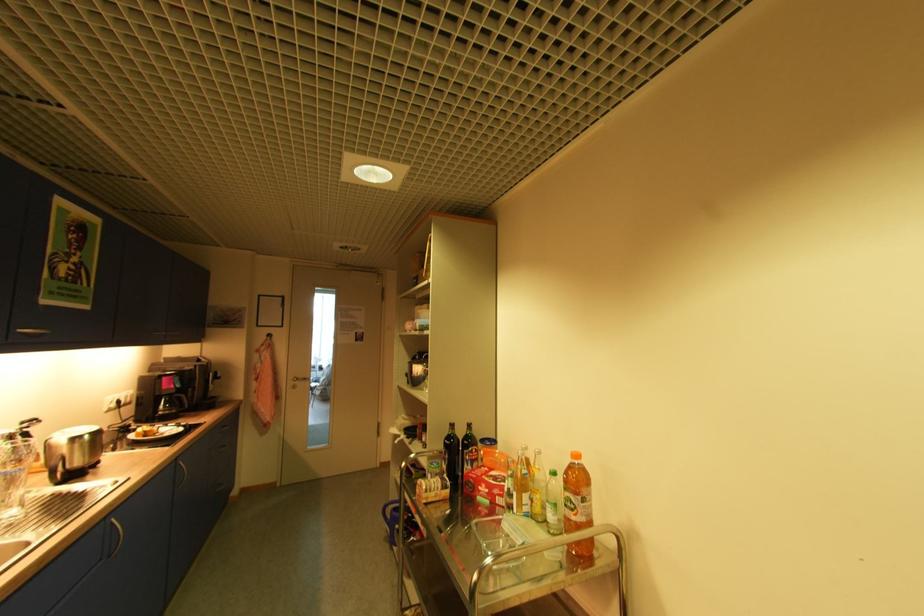
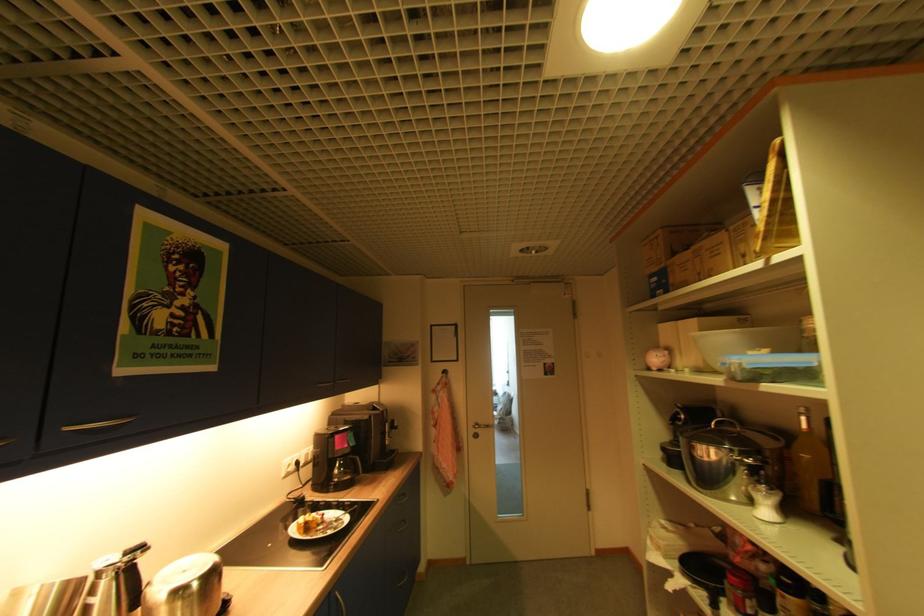
Where in the second image is the point corresponding to [169,379] from the first image?

(343, 437)